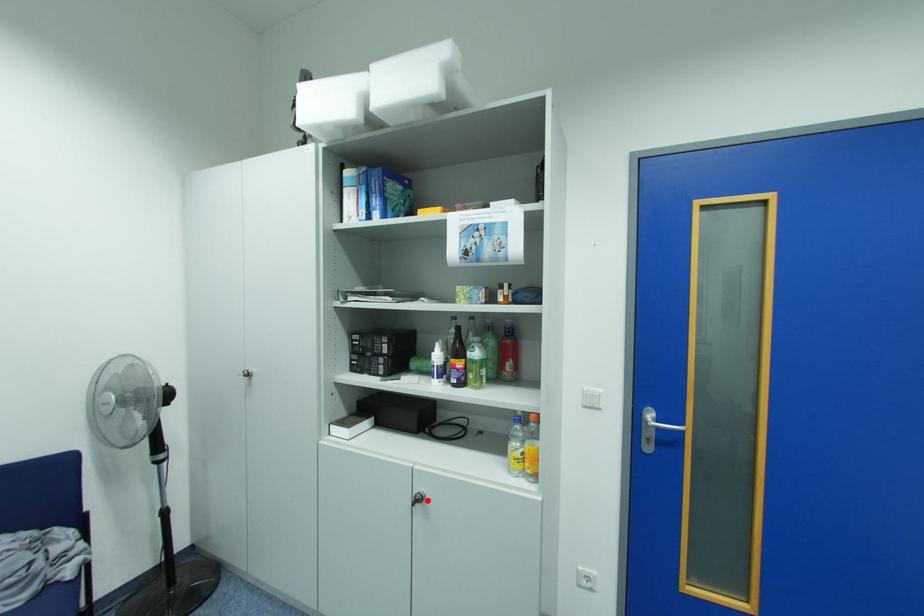
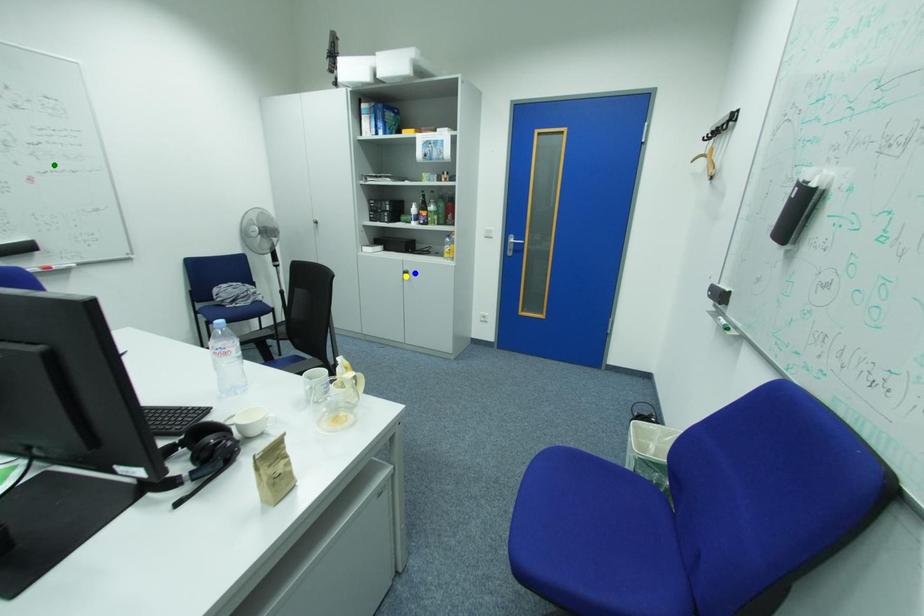
Question: I am providing you with two images of the same scene from different viewpoints. A red point is marked on the first image. You are given multiple points on the second image. In image 2, which mark is for the same physical point as the one in image 1?

Choices:
 (A) blue point
 (B) yellow point
 (C) green point

Answer: (A)